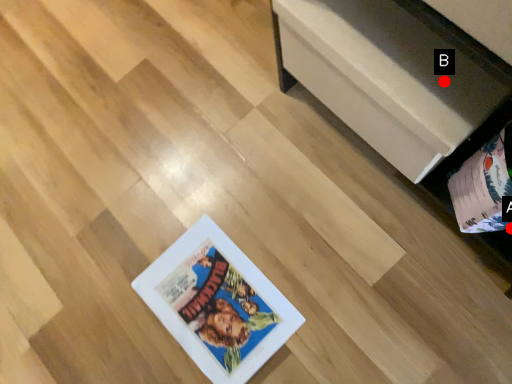
Question: Two points are circled on the image, labeled by A and B beside each circle. Which point appears closest to the camera in this image?

Choices:
 (A) A is closer
 (B) B is closer

Answer: (B)